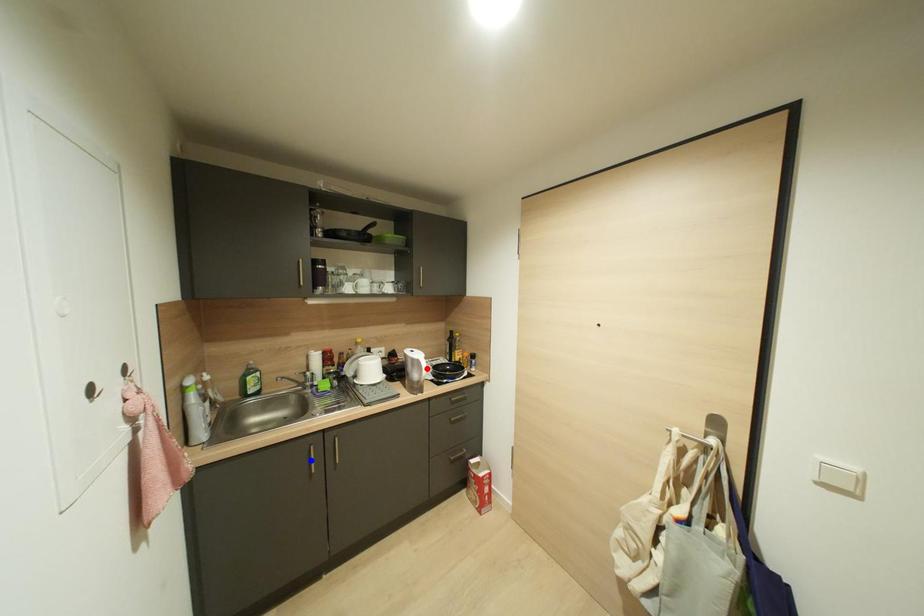
Question: Two points are marked on the image. Which point is closer to the camera?

Choices:
 (A) Blue point is closer.
 (B) Red point is closer.

Answer: (A)